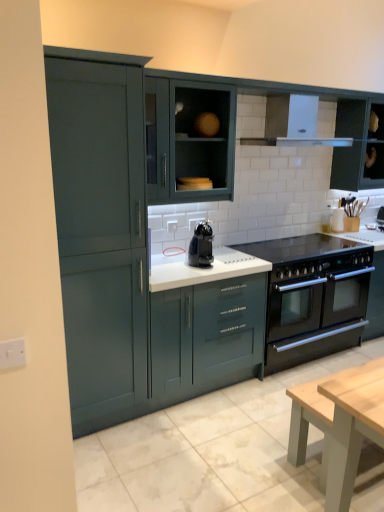
Question: From a real-world perspective, is matte dark green cabinet at center, arranged as the 4th cabinetry when viewed from the left, physically above white plastic switch at left, the first electric outlet ordered from the bottom?

Choices:
 (A) yes
 (B) no

Answer: (A)

Question: Considering the relative sizes of matte dark green cabinet at center, arranged as the 4th cabinetry when viewed from the left, and white plastic switch at left, which is the second electric outlet in top-to-bottom order, in the image provided, is matte dark green cabinet at center, arranged as the 4th cabinetry when viewed from the left, wider than white plastic switch at left, which is the second electric outlet in top-to-bottom order,?

Choices:
 (A) yes
 (B) no

Answer: (A)

Question: Is matte dark green cabinet at center, arranged as the 4th cabinetry when viewed from the left, further to the viewer compared to white plastic switch at left, which is the second electric outlet in top-to-bottom order?

Choices:
 (A) no
 (B) yes

Answer: (B)

Question: Is matte dark green cabinet at center, the 2th cabinetry from the right, positioned in front of white plastic switch at left, positioned as the 2th electric outlet in right-to-left order?

Choices:
 (A) no
 (B) yes

Answer: (A)

Question: From a real-world perspective, is matte dark green cabinet at center, the 2th cabinetry from the right, physically below white plastic switch at left, the 1th electric outlet in the front-to-back sequence?

Choices:
 (A) yes
 (B) no

Answer: (B)

Question: Considering the positions of point (228, 124) and point (200, 115), is point (228, 124) closer or farther from the camera than point (200, 115)?

Choices:
 (A) closer
 (B) farther

Answer: (A)

Question: From the image's perspective, is matte dark green cabinet at center, arranged as the 4th cabinetry when viewed from the left, positioned above or below matte green cabinet at upper center, marked as the 4th cabinetry in a right-to-left arrangement?

Choices:
 (A) below
 (B) above

Answer: (A)

Question: In the image, is matte dark green cabinet at center, the 2th cabinetry from the right, positioned in front of or behind matte green cabinet at upper center, marked as the 4th cabinetry in a right-to-left arrangement?

Choices:
 (A) front
 (B) behind

Answer: (B)

Question: From their relative heights in the image, would you say matte dark green cabinet at center, the 2th cabinetry from the right, is taller or shorter than matte green cabinet at upper center, which appears as the second cabinetry when viewed from the left?

Choices:
 (A) tall
 (B) short

Answer: (A)

Question: Is black glass gas stove at center bigger or smaller than matte green cabinet at left, which is the first cabinetry from left to right?

Choices:
 (A) big
 (B) small

Answer: (B)

Question: From the image's perspective, is black glass gas stove at center located above or below matte green cabinet at left, which is the first cabinetry from left to right?

Choices:
 (A) below
 (B) above

Answer: (A)

Question: From a real-world perspective, relative to matte green cabinet at left, which is the first cabinetry from left to right, is black glass gas stove at center vertically above or below?

Choices:
 (A) below
 (B) above

Answer: (A)

Question: From their relative heights in the image, would you say black glass gas stove at center is taller or shorter than matte green cabinet at left, which is the 5th cabinetry in right-to-left order?

Choices:
 (A) tall
 (B) short

Answer: (B)

Question: Choose the correct answer: Is white glossy exhaust hood at upper center inside matte dark green cabinet at center, arranged as the 4th cabinetry when viewed from the left, or outside it?

Choices:
 (A) inside
 (B) outside

Answer: (B)

Question: Considering the relative positions of white glossy exhaust hood at upper center and matte dark green cabinet at center, the 2th cabinetry from the right, in the image provided, is white glossy exhaust hood at upper center to the left or to the right of matte dark green cabinet at center, the 2th cabinetry from the right,?

Choices:
 (A) left
 (B) right

Answer: (A)